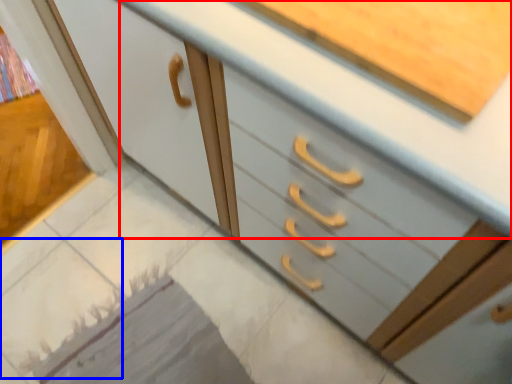
Question: Which object is further to the camera taking this photo, counter top (highlighted by a red box) or tile (highlighted by a blue box)?

Choices:
 (A) counter top
 (B) tile

Answer: (B)